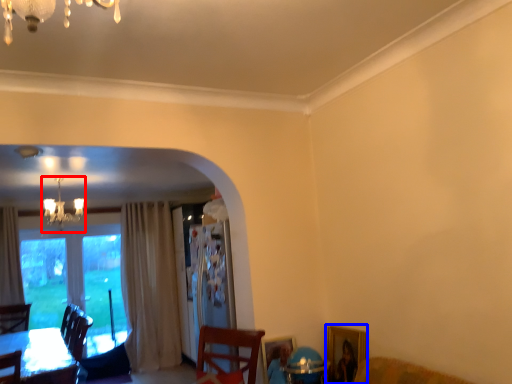
Question: Which object appears closest to the camera in this image, lamp (highlighted by a red box) or picture frame (highlighted by a blue box)?

Choices:
 (A) lamp
 (B) picture frame

Answer: (B)